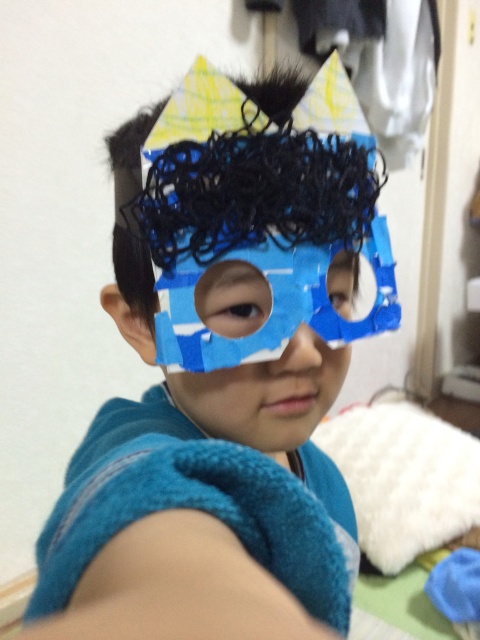
Consider the image. Is blue paper mask at center thinner than brown matte eye at center?

Incorrect, blue paper mask at center's width is not less than brown matte eye at center's.

Does blue paper mask at center appear over brown matte eye at center?

Actually, blue paper mask at center is below brown matte eye at center.

Image resolution: width=480 pixels, height=640 pixels. What do you see at coordinates (252, 364) in the screenshot?
I see `blue paper mask at center` at bounding box center [252, 364].

Locate an element on the screen. The image size is (480, 640). blue paper mask at center is located at coordinates (252, 364).

Can you confirm if blue cardboard mask at center is positioned above blue paper mask at center?

Actually, blue cardboard mask at center is below blue paper mask at center.

Can you confirm if blue cardboard mask at center is bigger than blue paper mask at center?

Yes.

The height and width of the screenshot is (640, 480). What are the coordinates of `blue cardboard mask at center` in the screenshot? It's located at (219, 385).

Is blue cardboard mask at center closer to camera compared to brown matte eye at center?

That is True.

Can you confirm if blue cardboard mask at center is positioned to the right of brown matte eye at center?

In fact, blue cardboard mask at center is to the left of brown matte eye at center.

Find the location of a particular element. The height and width of the screenshot is (640, 480). blue cardboard mask at center is located at coordinates (219, 385).

At what (x,y) coordinates should I click in order to perform the action: click on blue cardboard mask at center. Please return your answer as a coordinate pair (x, y). The width and height of the screenshot is (480, 640). Looking at the image, I should click on (219, 385).